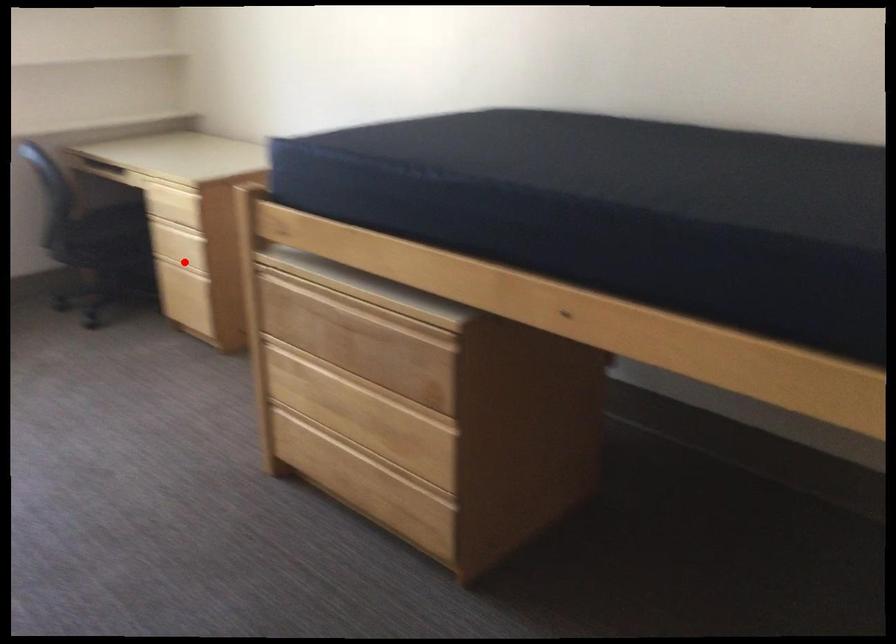
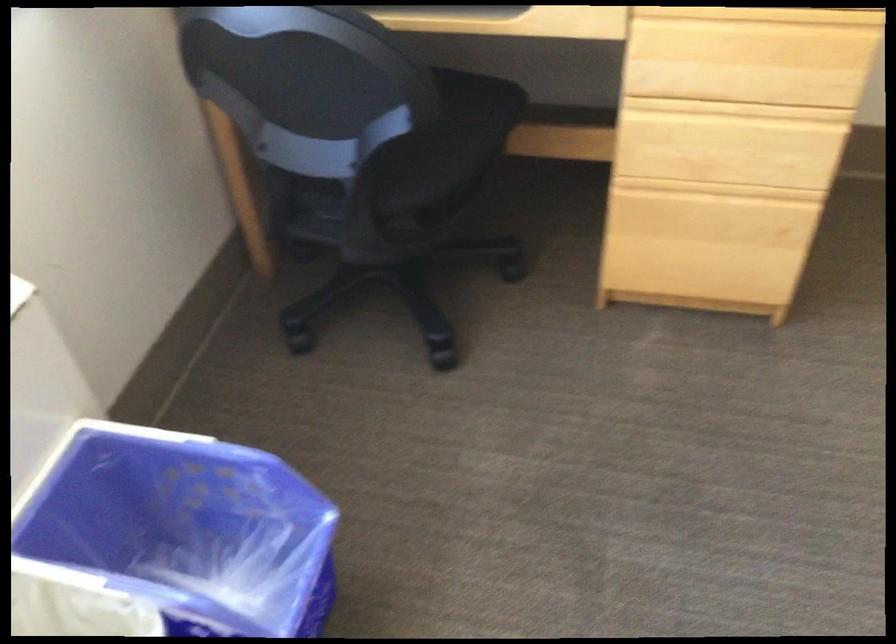
In the second image, find the point that corresponds to the highlighted location in the first image.

(718, 190)